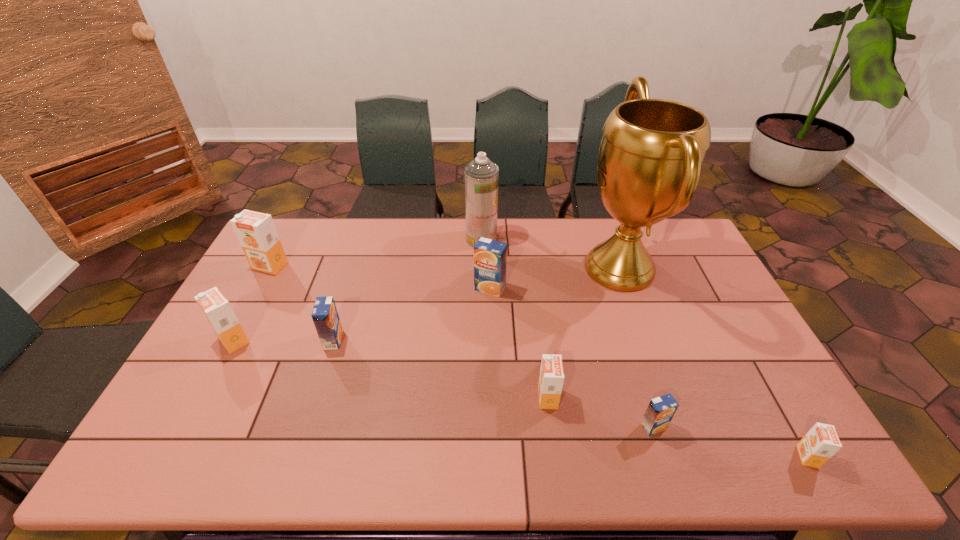
Locate which orange juice is the second closest to the second farthest orange orange juice. Please provide its 2D coordinates. Your answer should be formatted as a tuple, i.e. [(x, y)], where the tuple contains the x and y coordinates of a point satisfying the conditions above.

[(256, 232)]

Identify which orange orange juice is the nearest to the seventh farthest object. Please provide its 2D coordinates. Your answer should be formatted as a tuple, i.e. [(x, y)], where the tuple contains the x and y coordinates of a point satisfying the conditions above.

[(821, 442)]

Identify which orange orange juice is located as the second nearest to the tallest orange juice. Please provide its 2D coordinates. Your answer should be formatted as a tuple, i.e. [(x, y)], where the tuple contains the x and y coordinates of a point satisfying the conditions above.

[(551, 378)]

What are the coordinates of `blue orange_juice identified as the third closest to the gold trophy cup` in the screenshot? It's located at (325, 316).

The width and height of the screenshot is (960, 540). What are the coordinates of `blue orange_juice that is the third closest to the rightmost object` in the screenshot? It's located at (325, 316).

The width and height of the screenshot is (960, 540). Find the location of `vacant space that satisfies the following two spatial constraints: 1. on the front side of the second nearest orange juice; 2. on the left side of the seventh shortest object`. vacant space that satisfies the following two spatial constraints: 1. on the front side of the second nearest orange juice; 2. on the left side of the seventh shortest object is located at coordinates (182, 427).

Locate an element on the screen. The image size is (960, 540). vacant area in the image that satisfies the following two spatial constraints: 1. on the front side of the second orange juice from right to left; 2. on the right side of the second farthest orange juice is located at coordinates (493, 427).

You are a GUI agent. You are given a task and a screenshot of the screen. Output one action in this format:
    pyautogui.click(x=<x>, y=<y>)
    Task: Click on the free space that satisfies the following two spatial constraints: 1. on the surface of the tallest object with symbols; 2. on the front side of the nearest blue orange_juice
    This screenshot has height=540, width=960.
    Given the screenshot: What is the action you would take?
    pyautogui.click(x=676, y=427)